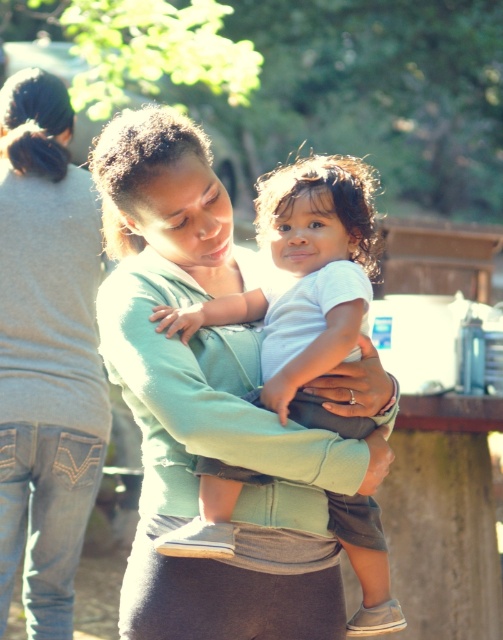
Can you confirm if matte green sweater at center is thinner than white soft cotton baby at center?

Yes, matte green sweater at center is thinner than white soft cotton baby at center.

Does point (25, 452) lie behind point (340, 280)?

That is True.

Is point (50, 83) more distant than point (363, 172)?

Yes, it is.

This screenshot has width=503, height=640. I want to click on matte green sweater at center, so click(x=45, y=353).